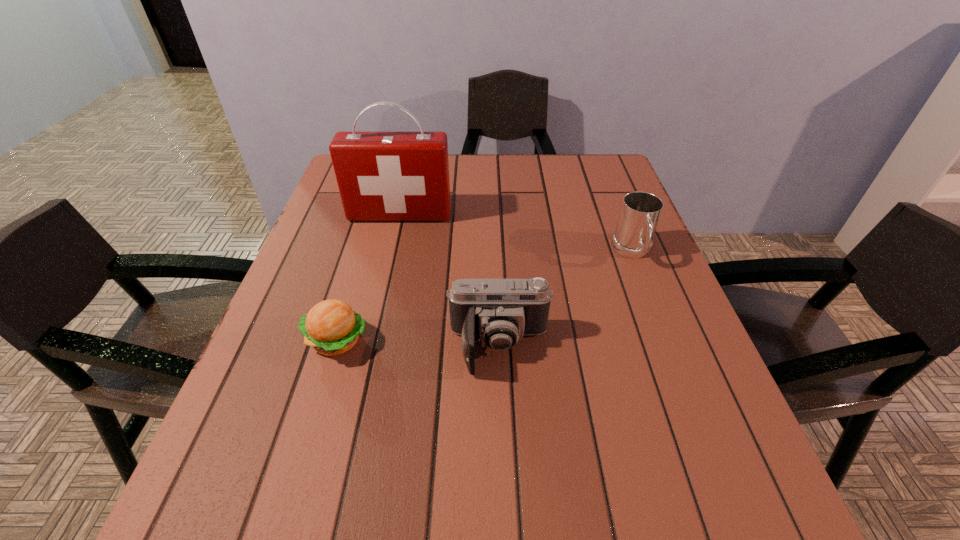
The image size is (960, 540). I want to click on the first-aid kit, so pos(382,176).

In order to click on the tallest object in this screenshot , I will do `click(382, 176)`.

I want to click on the rightmost object, so click(640, 211).

Where is `mug`? This screenshot has height=540, width=960. mug is located at coordinates (640, 211).

At what (x,y) coordinates should I click in order to perform the action: click on the third object from left to right. Please return your answer as a coordinate pair (x, y). Looking at the image, I should click on (498, 312).

Find the location of a particular element. The height and width of the screenshot is (540, 960). the shortest object is located at coordinates (331, 327).

Identify the location of vacant space located on the front face of the first-aid kit. The height and width of the screenshot is (540, 960). (373, 331).

Locate an element on the screen. This screenshot has width=960, height=540. free point located on the side of the mug with the handle is located at coordinates (657, 313).

Locate an element on the screen. The height and width of the screenshot is (540, 960). free spot located at the front of the camera with an open lens cover is located at coordinates (503, 443).

Where is `free point located 0.050m on the left of the shortest object`? free point located 0.050m on the left of the shortest object is located at coordinates (278, 340).